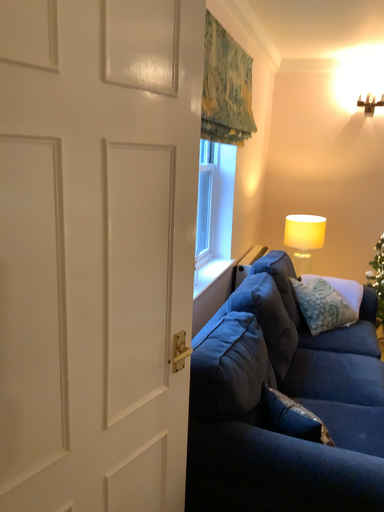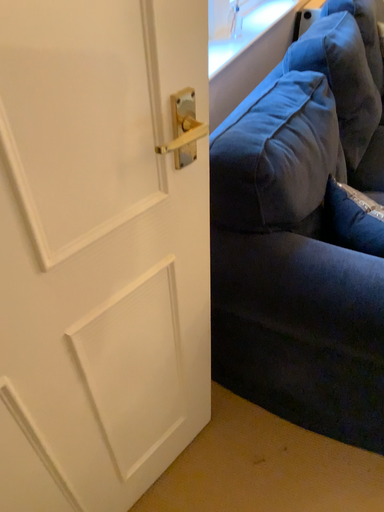
Question: Which way did the camera rotate in the video?

Choices:
 (A) rotated left
 (B) rotated right

Answer: (A)